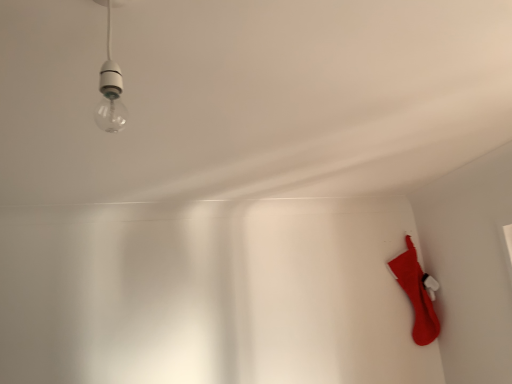
Question: From the image's perspective, is clear glass bulb at upper left located above or below red fabric stocking at lower right?

Choices:
 (A) below
 (B) above

Answer: (B)

Question: Does point (100, 104) appear closer or farther from the camera than point (415, 324)?

Choices:
 (A) farther
 (B) closer

Answer: (B)

Question: From their relative heights in the image, would you say clear glass bulb at upper left is taller or shorter than red fabric stocking at lower right?

Choices:
 (A) tall
 (B) short

Answer: (B)

Question: Is red fabric stocking at lower right in front of or behind clear glass bulb at upper left in the image?

Choices:
 (A) behind
 (B) front

Answer: (A)

Question: Is point pyautogui.click(x=412, y=269) closer or farther from the camera than point pyautogui.click(x=121, y=107)?

Choices:
 (A) farther
 (B) closer

Answer: (A)

Question: Is red fabric stocking at lower right bigger or smaller than clear glass bulb at upper left?

Choices:
 (A) small
 (B) big

Answer: (B)

Question: Based on their positions, is red fabric stocking at lower right located to the left or right of clear glass bulb at upper left?

Choices:
 (A) left
 (B) right

Answer: (B)